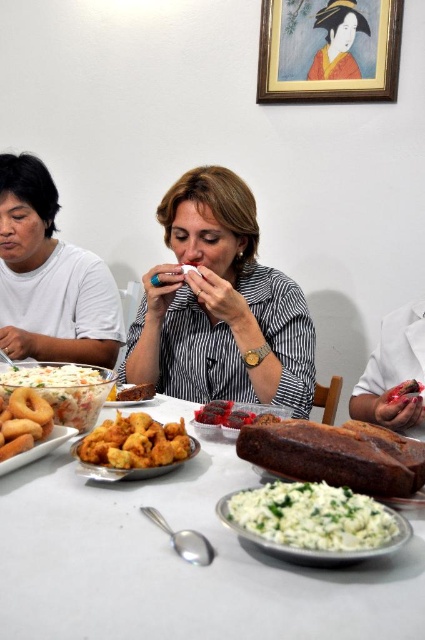
Question: Which object is farther from the camera taking this photo?

Choices:
 (A) wooden picture frame at upper center
 (B) golden fried nuggets at center
 (C) brown crumbly bread at center
 (D) white creamy salad at center left

Answer: (A)

Question: Can you confirm if matte black shirt at center is bigger than golden fried nuggets at center?

Choices:
 (A) yes
 (B) no

Answer: (A)

Question: Among these objects, which one is nearest to the camera?

Choices:
 (A) golden crispy onion rings at lower left
 (B) smooth paper mask at center
 (C) matte black shirt at center
 (D) golden fried chicken at center

Answer: (D)

Question: Which point is farther to the camera?

Choices:
 (A) white matte plate at center
 (B) white matte shirt at left
 (C) wooden picture frame at upper center

Answer: (C)

Question: Can you confirm if smooth paper mask at center is smaller than golden fried chicken at lower left?

Choices:
 (A) no
 (B) yes

Answer: (A)

Question: Does white matte plate at center appear on the right side of smooth paper mask at center?

Choices:
 (A) yes
 (B) no

Answer: (B)